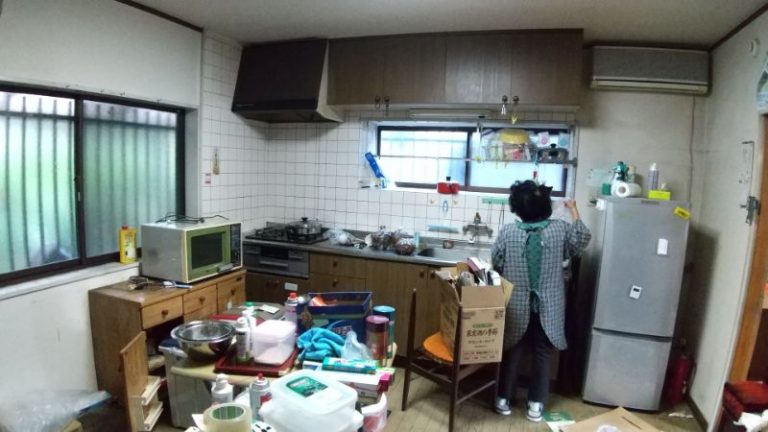
Where is `wall`? Image resolution: width=768 pixels, height=432 pixels. wall is located at coordinates (136, 46).